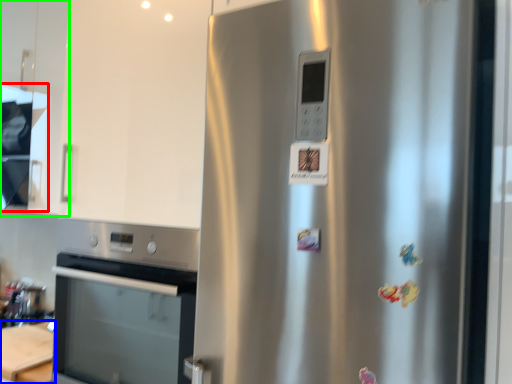
Question: Estimate the real-world distances between objects in this image. Which object is farther from exhaust hood (highlighted by a red box), table (highlighted by a blue box) or cabinetry (highlighted by a green box)?

Choices:
 (A) table
 (B) cabinetry

Answer: (A)